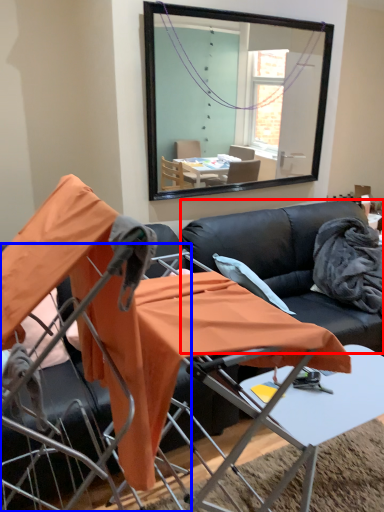
Question: Which of the following is the farthest to the observer, couch (highlighted by a red box) or chair (highlighted by a blue box)?

Choices:
 (A) couch
 (B) chair

Answer: (A)